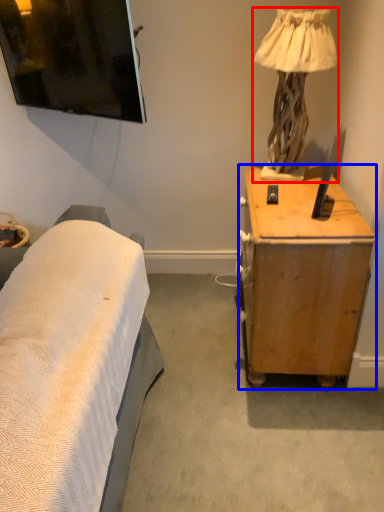
Question: Which object appears farthest to the camera in this image, lamp (highlighted by a red box) or desk (highlighted by a blue box)?

Choices:
 (A) lamp
 (B) desk

Answer: (A)